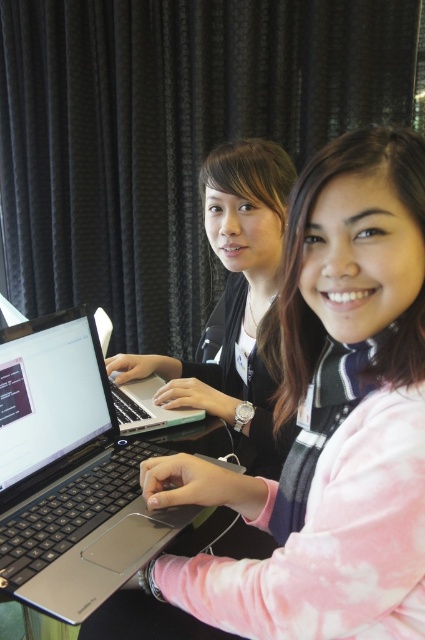
Question: Does pink matte sweater at center come behind sleek silver laptop at center?

Choices:
 (A) yes
 (B) no

Answer: (B)

Question: Estimate the real-world distances between objects in this image. Which object is farther from the silver metallic laptop at center?

Choices:
 (A) matte black laptop at center
 (B) pink matte sweater at center

Answer: (A)

Question: Which object is the farthest from the matte black laptop at center?

Choices:
 (A) sleek silver laptop at center
 (B) pink matte sweater at center
 (C) silver metallic laptop at center

Answer: (B)

Question: Is the position of matte black laptop at center less distant than that of sleek silver laptop at center?

Choices:
 (A) no
 (B) yes

Answer: (A)

Question: Which of the following is the farthest from the observer?

Choices:
 (A) sleek silver laptop at center
 (B) matte black laptop at center

Answer: (B)

Question: From the image, what is the correct spatial relationship of pink matte sweater at center in relation to matte black laptop at center?

Choices:
 (A) right
 (B) left

Answer: (A)